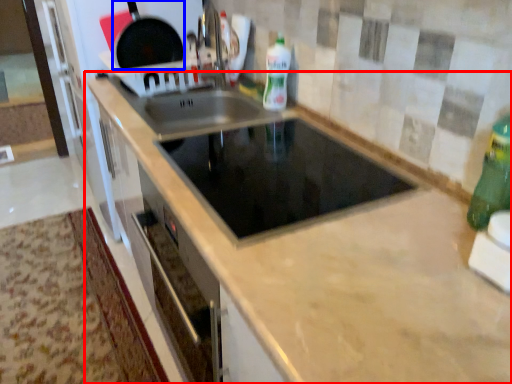
Question: Which object appears closest to the camera in this image, countertop (highlighted by a red box) or frying pan (highlighted by a blue box)?

Choices:
 (A) countertop
 (B) frying pan

Answer: (A)